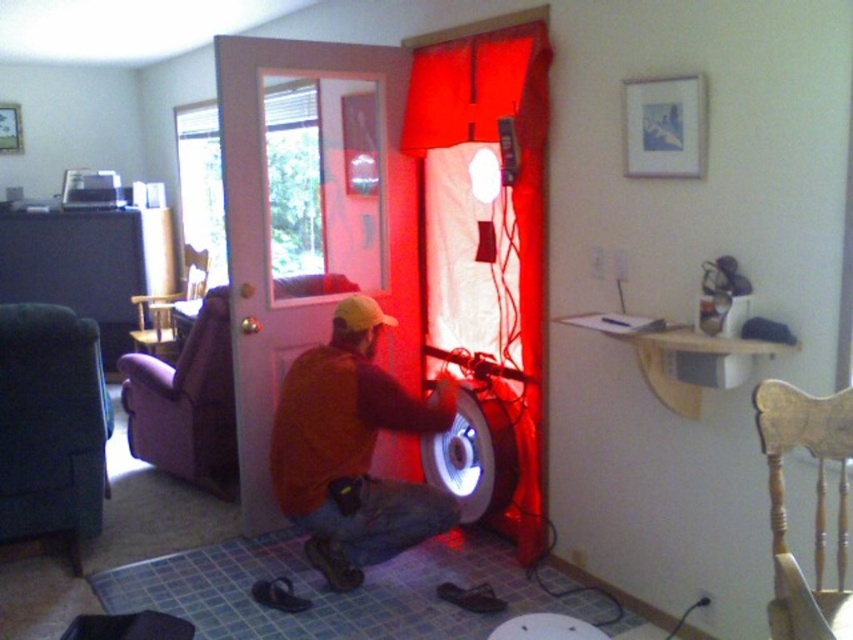
Question: Can you confirm if brown suede jacket at center is positioned to the right of red fabric curtain at center?

Choices:
 (A) yes
 (B) no

Answer: (B)

Question: Does brown suede jacket at center lie behind red fabric curtain at center?

Choices:
 (A) no
 (B) yes

Answer: (A)

Question: Among these points, which one is nearest to the camera?

Choices:
 (A) (260, 307)
 (B) (544, 534)
 (C) (367, 528)

Answer: (C)

Question: Which point is closer to the camera?

Choices:
 (A) white glossy door at center
 (B) red fabric curtain at center
 (C) brown suede jacket at center

Answer: (C)

Question: Which is farther from the red fabric curtain at center?

Choices:
 (A) white glossy door at center
 (B) brown suede jacket at center

Answer: (B)

Question: Can you confirm if brown suede jacket at center is positioned below red fabric curtain at center?

Choices:
 (A) no
 (B) yes

Answer: (B)